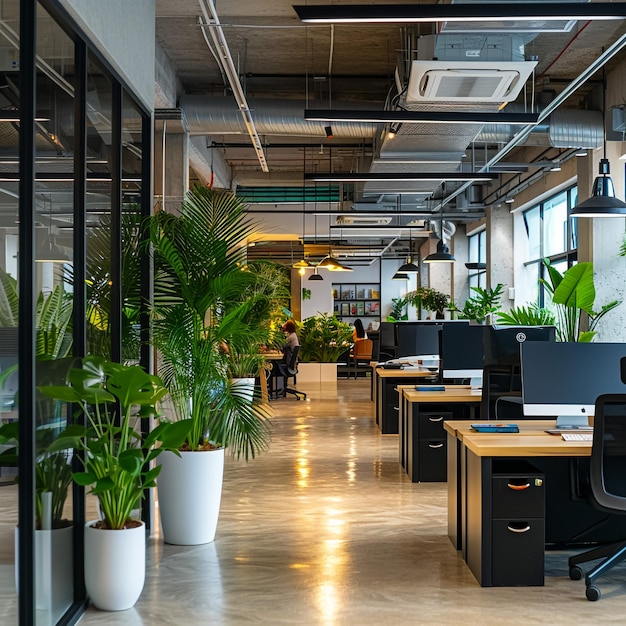
This screenshot has height=626, width=626. What are the coordinates of `plants sitting in white planters` in the screenshot? It's located at (208, 332), (109, 468), (578, 287).